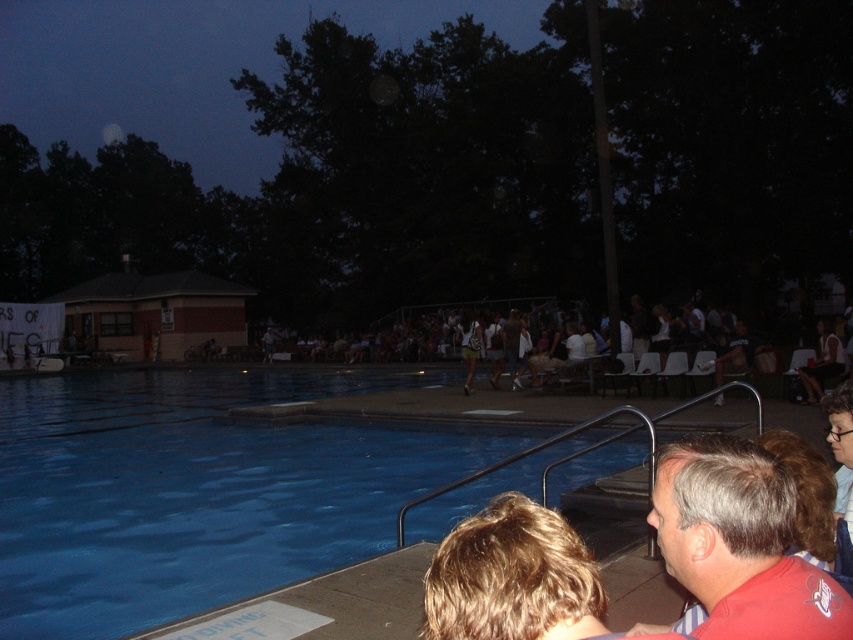
Between dark blue pool at center and red matte shirt at lower right, which one is positioned lower?

Positioned lower is red matte shirt at lower right.

Is dark blue pool at center positioned behind red matte shirt at lower right?

Yes, it is behind red matte shirt at lower right.

Describe the element at coordinates (346, 182) in the screenshot. This screenshot has height=640, width=853. I see `dark blue pool at center` at that location.

What are the coordinates of `dark blue pool at center` in the screenshot? It's located at (346, 182).

Between point (735, 253) and point (199, 592), which one is positioned behind?

The point (735, 253) is more distant.

Between dark blue pool at center and blue smooth water at lower left, which one is positioned lower?

blue smooth water at lower left is lower down.

Find the location of a particular element. dark blue pool at center is located at coordinates (346, 182).

How far apart are blue smooth water at lower left and red matte shirt at lower right?

blue smooth water at lower left is 13.12 meters from red matte shirt at lower right.

Between blue smooth water at lower left and red matte shirt at lower right, which one appears on the left side from the viewer's perspective?

From the viewer's perspective, blue smooth water at lower left appears more on the left side.

The width and height of the screenshot is (853, 640). I want to click on blue smooth water at lower left, so click(x=200, y=488).